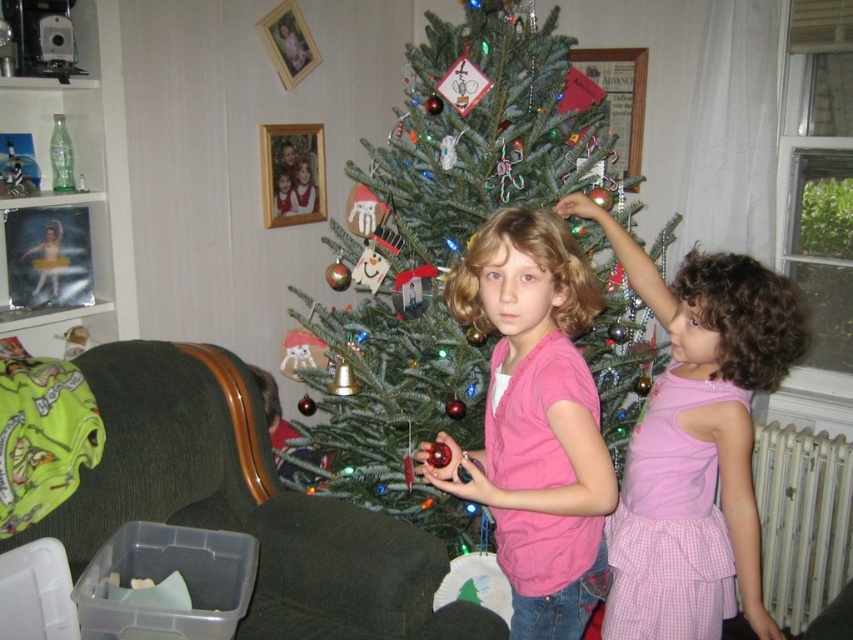
Is pink matte shirt at center wider than pink cotton dress at center?

No, pink matte shirt at center is not wider than pink cotton dress at center.

Locate an element on the screen. The width and height of the screenshot is (853, 640). pink matte shirt at center is located at coordinates (534, 420).

Which is in front, point (595, 516) or point (718, 436)?

Point (595, 516) is more forward.

I want to click on pink matte shirt at center, so click(x=534, y=420).

Does dark green fabric armchair at lower left appear on the left side of pink matte shirt at center?

Indeed, dark green fabric armchair at lower left is positioned on the left side of pink matte shirt at center.

Can you confirm if dark green fabric armchair at lower left is smaller than pink matte shirt at center?

No, dark green fabric armchair at lower left is not smaller than pink matte shirt at center.

Is point (318, 528) behind point (585, 596)?

Yes, it is.

The height and width of the screenshot is (640, 853). What are the coordinates of `dark green fabric armchair at lower left` in the screenshot? It's located at (247, 502).

Is green matte christmas tree at center to the right of pink cotton dress at center from the viewer's perspective?

No, green matte christmas tree at center is not to the right of pink cotton dress at center.

Who is lower down, green matte christmas tree at center or pink cotton dress at center?

pink cotton dress at center is below.

Find the location of a particular element. Image resolution: width=853 pixels, height=640 pixels. green matte christmas tree at center is located at coordinates point(440,253).

I want to click on green matte christmas tree at center, so click(440, 253).